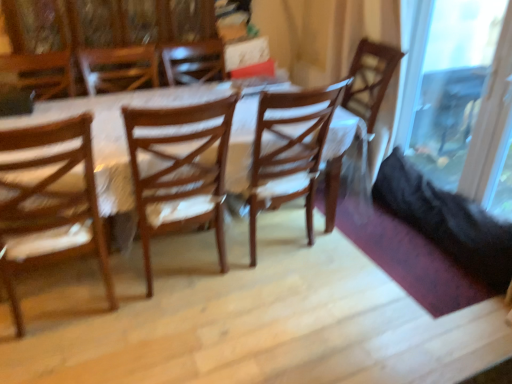
Identify the location of transparent glass door at right. The width and height of the screenshot is (512, 384). pos(459,93).

This screenshot has width=512, height=384. In order to click on wooden chair at center, the second chair viewed from the left in this screenshot , I will do `click(179, 169)`.

Can you confirm if transparent glass door at right is shorter than wooden chair at left, the first chair in the left-to-right sequence?

In fact, transparent glass door at right may be taller than wooden chair at left, the first chair in the left-to-right sequence.

Is transparent glass door at right in front of or behind wooden chair at left, acting as the third chair starting from the right, in the image?

transparent glass door at right is positioned farther from the viewer than wooden chair at left, acting as the third chair starting from the right.

Is transparent glass door at right to the left of wooden chair at left, acting as the third chair starting from the right, from the viewer's perspective?

In fact, transparent glass door at right is to the right of wooden chair at left, acting as the third chair starting from the right.

Is transparent glass door at right positioned with its back to wooden chair at left, acting as the third chair starting from the right?

No, transparent glass door at right is not facing away from wooden chair at left, acting as the third chair starting from the right.

In the scene shown: Considering the positions of objects wooden chair at left, acting as the third chair starting from the right, and wooden chair at center, placed as the third chair when sorted from left to right, in the image provided, who is more to the left, wooden chair at left, acting as the third chair starting from the right, or wooden chair at center, placed as the third chair when sorted from left to right,?

Positioned to the left is wooden chair at left, acting as the third chair starting from the right.

Is wooden chair at left, acting as the third chair starting from the right, positioned far away from wooden chair at center, placed as the third chair when sorted from left to right?

wooden chair at left, acting as the third chair starting from the right, is far away from wooden chair at center, placed as the third chair when sorted from left to right.

Considering the positions of points (9, 295) and (361, 91), is point (9, 295) closer to camera compared to point (361, 91)?

Yes, it is in front of point (361, 91).

In the image, is wooden chair at center, the second chair in the right-to-left sequence, positioned in front of or behind wooden chair at center, placed as the third chair when sorted from left to right?

In the image, wooden chair at center, the second chair in the right-to-left sequence, appears in front of wooden chair at center, placed as the third chair when sorted from left to right.

The image size is (512, 384). Find the location of `chair that is the 1st object to the left of the wooden chair at center, placed as the third chair when sorted from left to right, starting at the anchor`. chair that is the 1st object to the left of the wooden chair at center, placed as the third chair when sorted from left to right, starting at the anchor is located at coordinates pyautogui.click(x=179, y=169).

From the image's perspective, is wooden chair at center, the second chair viewed from the left, over wooden chair at center, placed as the third chair when sorted from left to right?

No, from the image's perspective, wooden chair at center, the second chair viewed from the left, is not on top of wooden chair at center, placed as the third chair when sorted from left to right.

Between wooden chair at center, the second chair viewed from the left, and wooden chair at center, which is counted as the first chair, starting from the right, which one has less height?

With less height is wooden chair at center, the second chair viewed from the left.

Are transparent glass door at right and wooden chair at center, which is counted as the first chair, starting from the right, far apart?

They are positioned close to each other.

From a real-world perspective, relative to wooden chair at center, which is counted as the first chair, starting from the right, is transparent glass door at right vertically above or below?

transparent glass door at right is above wooden chair at center, which is counted as the first chair, starting from the right.

Considering the sizes of objects transparent glass door at right and wooden chair at center, which is counted as the first chair, starting from the right, in the image provided, who is shorter, transparent glass door at right or wooden chair at center, which is counted as the first chair, starting from the right,?

Standing shorter between the two is wooden chair at center, which is counted as the first chair, starting from the right.

Who is smaller, transparent glass door at right or wooden chair at center, placed as the third chair when sorted from left to right?

With smaller size is transparent glass door at right.

Is wooden chair at center, placed as the third chair when sorted from left to right, wider than transparent glass door at right?

Indeed, wooden chair at center, placed as the third chair when sorted from left to right, has a greater width compared to transparent glass door at right.

Which is nearer, (331, 168) or (458, 179)?

Point (331, 168) is positioned farther from the camera compared to point (458, 179).

Locate an element on the screen. The width and height of the screenshot is (512, 384). glass door lying on the right of wooden chair at center, placed as the third chair when sorted from left to right is located at coordinates (459, 93).

At what (x,y) coordinates should I click in order to perform the action: click on chair above the wooden chair at left, acting as the third chair starting from the right (from a real-world perspective). Please return your answer as a coordinate pair (x, y). Looking at the image, I should click on (179, 169).

From a real-world perspective, does wooden chair at center, the second chair in the right-to-left sequence, sit lower than wooden chair at left, the first chair in the left-to-right sequence?

No, from a real-world perspective, wooden chair at center, the second chair in the right-to-left sequence, is not beneath wooden chair at left, the first chair in the left-to-right sequence.

Does wooden chair at center, the second chair viewed from the left, have a smaller size compared to wooden chair at left, the first chair in the left-to-right sequence?

Indeed, wooden chair at center, the second chair viewed from the left, has a smaller size compared to wooden chair at left, the first chair in the left-to-right sequence.

Can you confirm if wooden chair at center, the second chair in the right-to-left sequence, is wider than transparent glass door at right?

Indeed, wooden chair at center, the second chair in the right-to-left sequence, has a greater width compared to transparent glass door at right.

Consider the image. Who is smaller, wooden chair at center, the second chair viewed from the left, or transparent glass door at right?

Smaller between the two is transparent glass door at right.

From the image's perspective, is wooden chair at center, the second chair viewed from the left, under transparent glass door at right?

Correct, wooden chair at center, the second chair viewed from the left, appears lower than transparent glass door at right in the image.

Based on the photo, which object is positioned more to the right, wooden chair at center, the second chair viewed from the left, or transparent glass door at right?

From the viewer's perspective, transparent glass door at right appears more on the right side.

Image resolution: width=512 pixels, height=384 pixels. In order to click on glass door that is behind the wooden chair at left, the first chair in the left-to-right sequence in this screenshot , I will do `click(459, 93)`.

The height and width of the screenshot is (384, 512). What are the coordinates of `chair that appears below the wooden chair at left, acting as the third chair starting from the right (from a real-world perspective)` in the screenshot? It's located at (376, 81).

When comparing their distances from wooden chair at center, the second chair viewed from the left, does wooden chair at left, the first chair in the left-to-right sequence, or transparent glass door at right seem further?

transparent glass door at right is further to wooden chair at center, the second chair viewed from the left.

Considering their positions, is wooden chair at center, placed as the third chair when sorted from left to right, positioned closer to wooden chair at left, acting as the third chair starting from the right, than transparent glass door at right?

The object closer to wooden chair at left, acting as the third chair starting from the right, is wooden chair at center, placed as the third chair when sorted from left to right.

From the picture: When comparing their distances from transparent glass door at right, does wooden chair at center, the second chair in the right-to-left sequence, or wooden chair at left, the first chair in the left-to-right sequence, seem further?

Based on the image, wooden chair at left, the first chair in the left-to-right sequence, appears to be further to transparent glass door at right.

Based on their spatial positions, is transparent glass door at right or wooden chair at center, the second chair in the right-to-left sequence, closer to wooden chair at center, placed as the third chair when sorted from left to right?

Among the two, transparent glass door at right is located nearer to wooden chair at center, placed as the third chair when sorted from left to right.

Estimate the real-world distances between objects in this image. Which object is closer to transparent glass door at right, wooden chair at center, placed as the third chair when sorted from left to right, or wooden chair at left, acting as the third chair starting from the right?

Among the two, wooden chair at center, placed as the third chair when sorted from left to right, is located nearer to transparent glass door at right.

Which object lies further to the anchor point wooden chair at left, the first chair in the left-to-right sequence, wooden chair at center, the second chair in the right-to-left sequence, or wooden chair at center, which is counted as the first chair, starting from the right?

wooden chair at center, which is counted as the first chair, starting from the right, is positioned further to the anchor wooden chair at left, the first chair in the left-to-right sequence.

Estimate the real-world distances between objects in this image. Which object is further from wooden chair at left, the first chair in the left-to-right sequence, wooden chair at center, the second chair viewed from the left, or transparent glass door at right?

transparent glass door at right is further to wooden chair at left, the first chair in the left-to-right sequence.

Based on their spatial positions, is wooden chair at left, the first chair in the left-to-right sequence, or wooden chair at center, the second chair in the right-to-left sequence, further from wooden chair at center, placed as the third chair when sorted from left to right?

wooden chair at left, the first chair in the left-to-right sequence.

Find the location of `chair situated between wooden chair at left, the first chair in the left-to-right sequence, and wooden chair at center, which is counted as the first chair, starting from the right, from left to right`. chair situated between wooden chair at left, the first chair in the left-to-right sequence, and wooden chair at center, which is counted as the first chair, starting from the right, from left to right is located at coordinates (179, 169).

At what (x,y) coordinates should I click in order to perform the action: click on chair located between wooden chair at center, the second chair in the right-to-left sequence, and transparent glass door at right in the left-right direction. Please return your answer as a coordinate pair (x, y). This screenshot has height=384, width=512. Looking at the image, I should click on (376, 81).